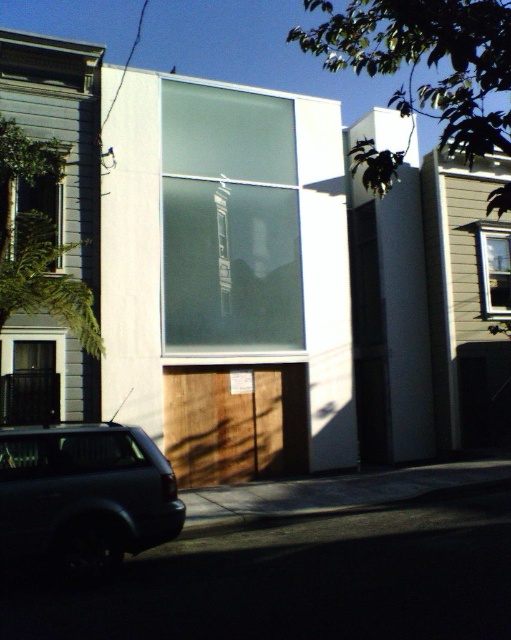
Is satin glass window at center wider than clear glass window at left?

Correct, the width of satin glass window at center exceeds that of clear glass window at left.

Is the position of satin glass window at center more distant than that of clear glass window at left?

That is True.

Image resolution: width=511 pixels, height=640 pixels. Describe the element at coordinates (229, 220) in the screenshot. I see `satin glass window at center` at that location.

Where is `satin glass window at center`? The width and height of the screenshot is (511, 640). satin glass window at center is located at coordinates (229, 220).

Which is in front, point (0, 536) or point (482, 248)?

Point (0, 536)

Based on the photo, does shiny black suv at lower left have a lesser height compared to clear glass window at center?

Yes.

This screenshot has width=511, height=640. What are the coordinates of `shiny black suv at lower left` in the screenshot? It's located at (83, 497).

Is point (274, 317) less distant than point (497, 227)?

Yes, point (274, 317) is closer to viewer.

Does satin glass window at center appear under clear glass window at center?

Incorrect, satin glass window at center is not positioned below clear glass window at center.

What are the coordinates of `satin glass window at center` in the screenshot? It's located at (229, 220).